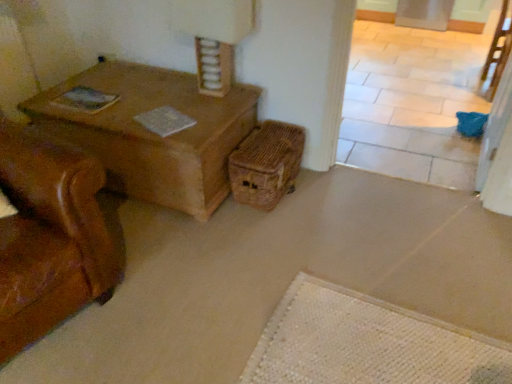
At what (x,y) coordinates should I click in order to perform the action: click on free space to the right of woven brown basket at lower right. Please return your answer as a coordinate pair (x, y). Looking at the image, I should click on (331, 196).